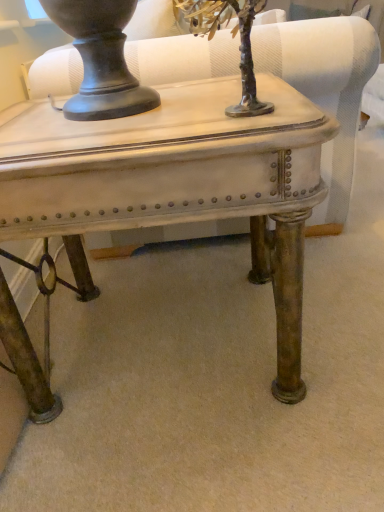
Question: Is matte white swivel chair at center wider or thinner than metallic silver tree at upper center?

Choices:
 (A) thin
 (B) wide

Answer: (B)

Question: Does point (210, 70) appear closer or farther from the camera than point (248, 100)?

Choices:
 (A) closer
 (B) farther

Answer: (B)

Question: Which object is positioned closest to the matte white table at center?

Choices:
 (A) matte white swivel chair at center
 (B) metallic silver tree at upper center

Answer: (B)

Question: Based on their relative distances, which object is farther from the metallic silver tree at upper center?

Choices:
 (A) matte white swivel chair at center
 (B) matte white table at center

Answer: (A)